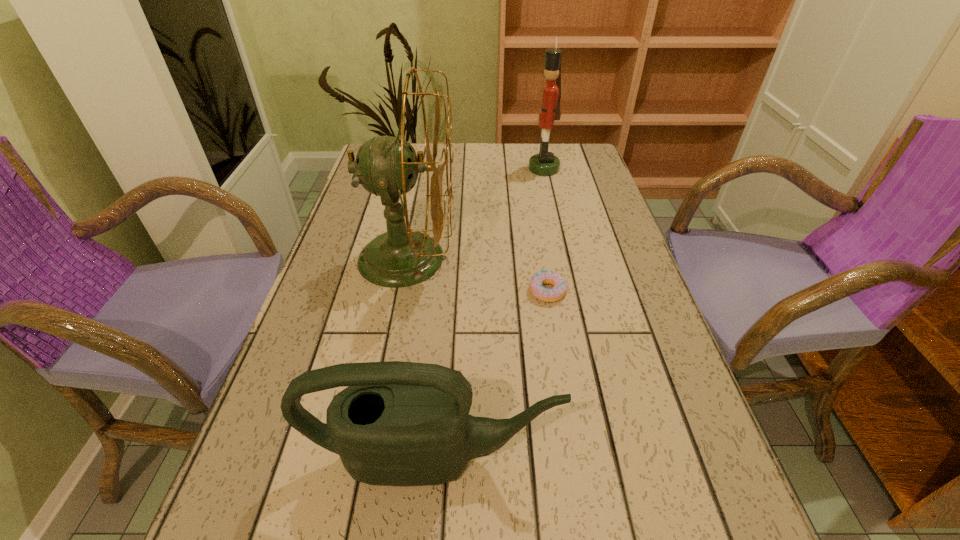
Locate an element on the screen. The height and width of the screenshot is (540, 960). vacant point that satisfies the following two spatial constraints: 1. on the front-facing side of the farthest object; 2. on the spout of the third tallest object is located at coordinates (608, 458).

In order to click on free point that satisfies the following two spatial constraints: 1. on the back side of the shortest object; 2. in front of the fan, directing air flow in this screenshot , I will do `click(542, 258)`.

This screenshot has width=960, height=540. I want to click on free space that satisfies the following two spatial constraints: 1. on the back side of the doughnut; 2. in front of the fan, directing air flow, so click(x=542, y=258).